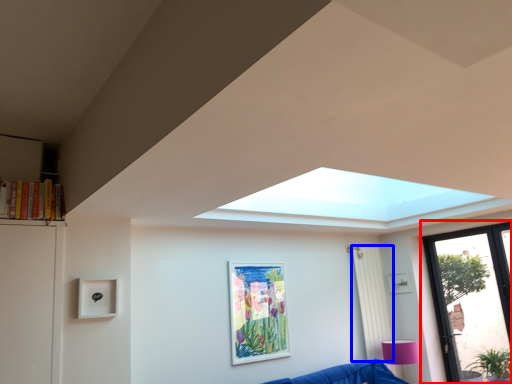
Question: Among these objects, which one is nearest to the camera, window (highlighted by a red box) or curtain (highlighted by a blue box)?

Choices:
 (A) window
 (B) curtain

Answer: (A)